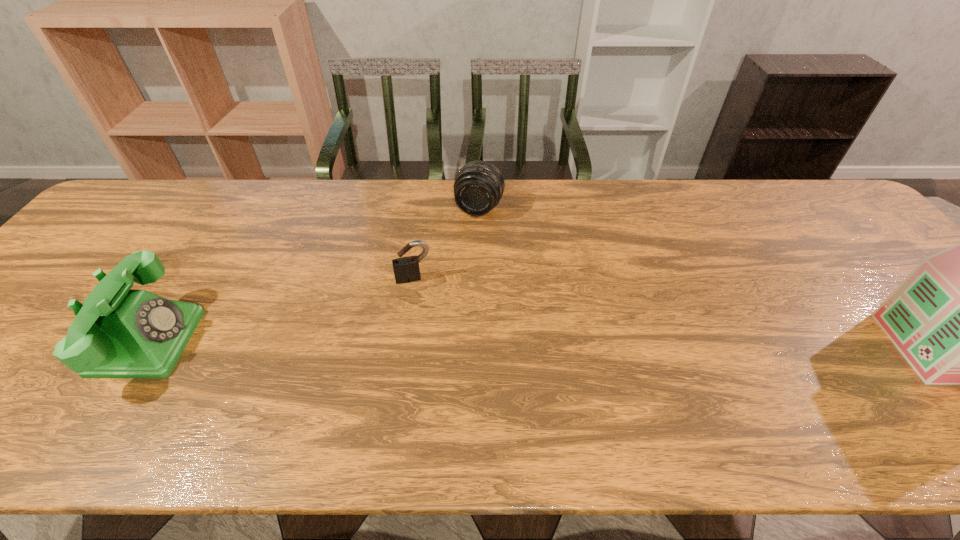
Identify the location of blank area located 0.270m at the front element of the farthest object. (449, 288).

Locate an element on the screen. The height and width of the screenshot is (540, 960). vacant space located at the front element of the farthest object is located at coordinates (441, 308).

Identify the location of vacant space located 0.400m at the front element of the farthest object. The width and height of the screenshot is (960, 540). (434, 327).

I want to click on object at the far edge, so click(x=479, y=186).

Locate an element on the screen. This screenshot has height=540, width=960. object present at the near edge is located at coordinates (117, 333).

This screenshot has height=540, width=960. In the image, there is a desktop. Identify the location of vacant space at the far edge. (513, 213).

Identify the location of vacant space at the near edge of the desktop. (445, 395).

Locate an element on the screen. The image size is (960, 540). free region at the far left corner of the desktop is located at coordinates (140, 186).

Where is `vacant area between the padlock and the third shortest object`? vacant area between the padlock and the third shortest object is located at coordinates (280, 310).

You are a GUI agent. You are given a task and a screenshot of the screen. Output one action in this format:
    pyautogui.click(x=<x>, y=<y>)
    Task: Click on the free space between the shortest object and the telephone
    The width and height of the screenshot is (960, 540).
    Given the screenshot: What is the action you would take?
    pyautogui.click(x=280, y=310)